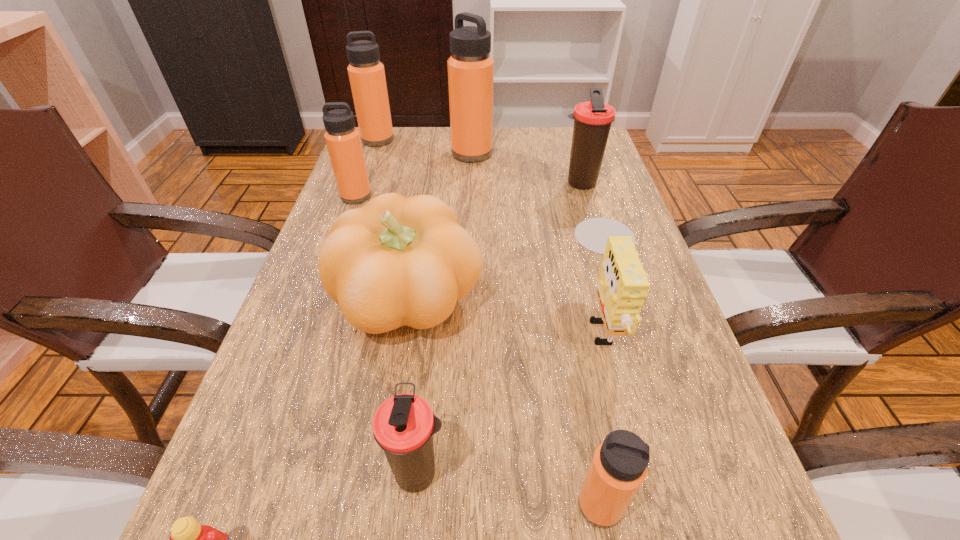
At what (x,y) coordinates should I click in order to perform the action: click on the tallest object. Please return your answer as a coordinate pair (x, y). This screenshot has width=960, height=540. Looking at the image, I should click on (470, 67).

The height and width of the screenshot is (540, 960). Find the location of `the tallest thermos bottle`. the tallest thermos bottle is located at coordinates pos(470,67).

Where is `the fifth shortest thermos bottle`? The image size is (960, 540). the fifth shortest thermos bottle is located at coordinates (366, 73).

Identify the location of the second tallest object. (366, 73).

Identify the location of the rightmost thermos bottle. This screenshot has width=960, height=540. (592, 120).

This screenshot has width=960, height=540. I want to click on the bigger brown thermos bottle, so click(592, 120).

I want to click on the third farthest orange thermos bottle, so click(x=343, y=140).

You are a GUI agent. You are given a task and a screenshot of the screen. Output one action in this format:
    pyautogui.click(x=<x>, y=<y>)
    Task: Click on the pumpkin
    
    Given the screenshot: What is the action you would take?
    tap(397, 261)

This screenshot has height=540, width=960. What are the coordinates of `yellow sponge` in the screenshot? It's located at (623, 286).

Find the location of a particular element. The width and height of the screenshot is (960, 540). the nearer brown thermos bottle is located at coordinates (403, 426).